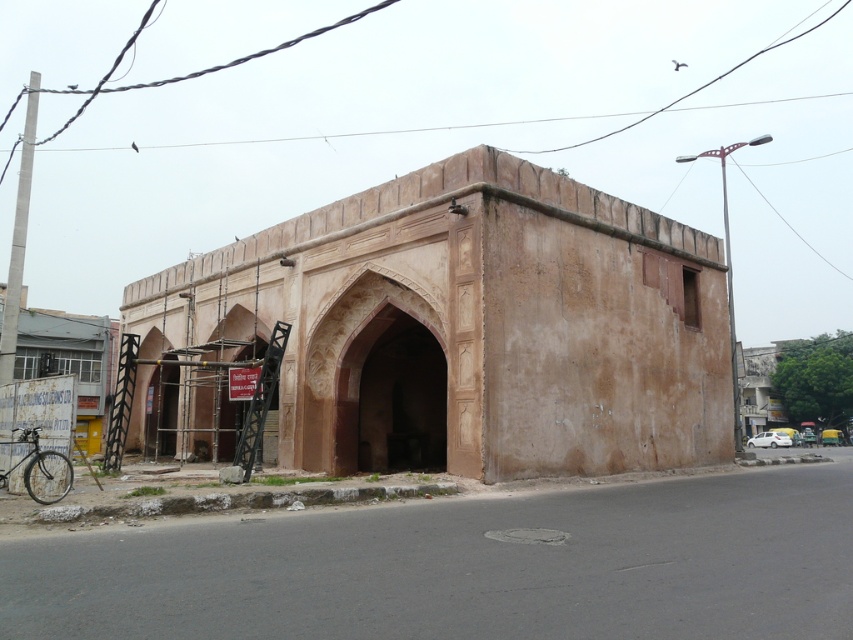
You are standing in front of the old structure and want to take a photo of the brown rough stone archway at center. Based on its position, where should you aim your camera to capture it in the frame?

The brown rough stone archway at center is located at the coordinates 0.511 on the x axis and 0.551 on the y axis, so you should aim your camera at those coordinates to capture it in the frame.